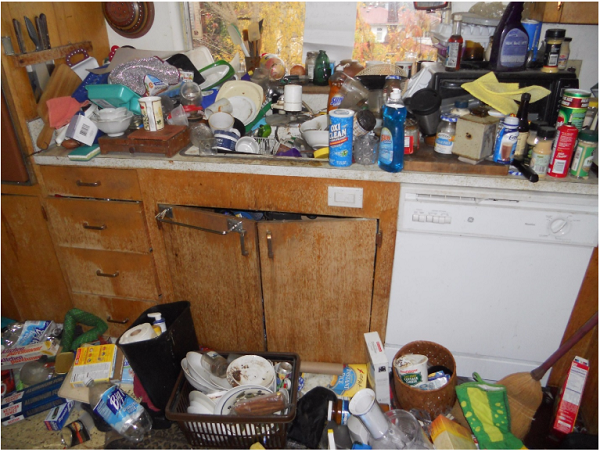
Locate an element on the screen. This screenshot has width=600, height=452. wooden cupboard is located at coordinates (334, 258), (228, 253).